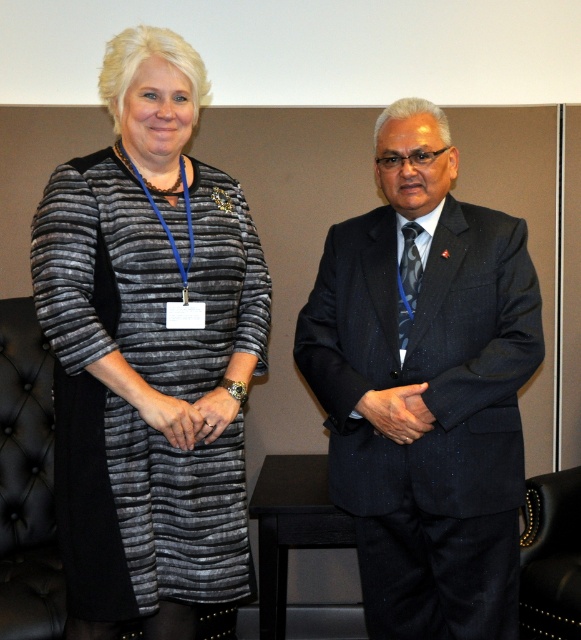
Does dark blue textured suit at right appear on the right side of black leather armchair at lower right?

Incorrect, dark blue textured suit at right is not on the right side of black leather armchair at lower right.

Which of these two, dark blue textured suit at right or black leather armchair at lower right, stands shorter?

Standing shorter between the two is black leather armchair at lower right.

At what (x,y) coordinates should I click in order to perform the action: click on dark blue textured suit at right. Please return your answer as a coordinate pair (x, y). This screenshot has width=581, height=640. Looking at the image, I should click on (425, 387).

Which is above, striped fabric dress at center or tufted leather armchair at lower left?

striped fabric dress at center is above.

Which is behind, point (166, 394) or point (59, 570)?

The point (59, 570) is behind.

At what (x,y) coordinates should I click in order to perform the action: click on striped fabric dress at center. Please return your answer as a coordinate pair (x, y). Looking at the image, I should click on (149, 353).

Does tufted leather armchair at lower left have a greater width compared to black leather armchair at lower right?

Yes.

Is point (8, 416) farther from camera compared to point (571, 508)?

Yes, it is.

The width and height of the screenshot is (581, 640). I want to click on tufted leather armchair at lower left, so click(x=26, y=481).

Identify the location of tufted leather armchair at lower left. Image resolution: width=581 pixels, height=640 pixels. (26, 481).